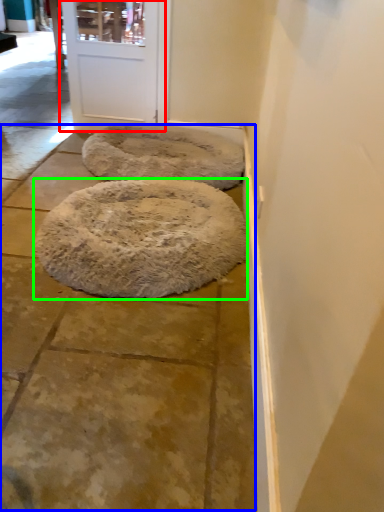
Question: Estimate the real-world distances between objects in this image. Which object is farther from door (highlighted by a red box), pavement (highlighted by a blue box) or dog bed (highlighted by a green box)?

Choices:
 (A) pavement
 (B) dog bed

Answer: (A)